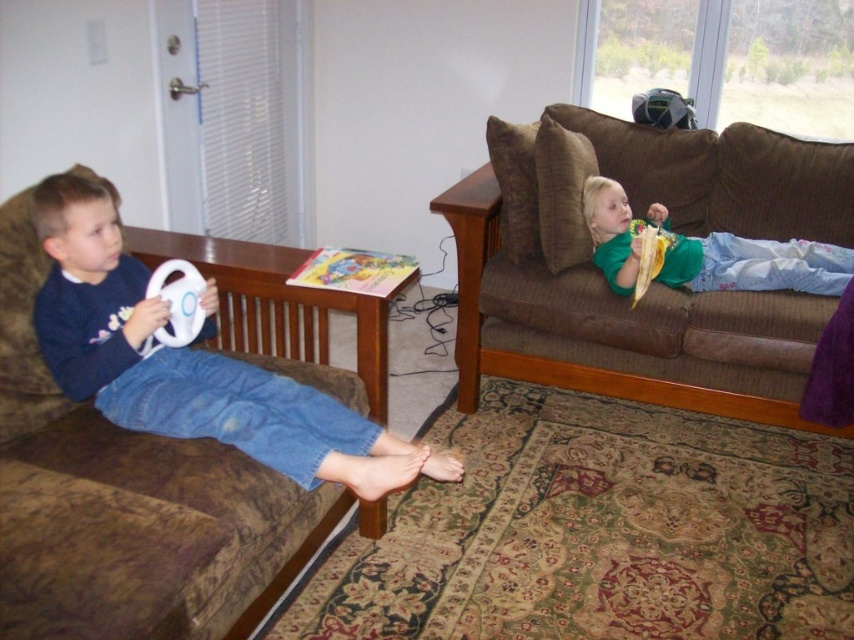
You are standing in the living room and see two points marked in the image. Which point, point (94, 442) or point (762, 262), is closer to you?

Point (94, 442) is closer to the viewer than point (762, 262).

You are a parent trying to decide where to place a new toy box in the living room. The toy box is the same size as the green cotton shirt at upper right. Based on the scene, can the toy box fit in the space where the brown fabric couch at left is currently located?

The brown fabric couch at left is larger in size than the green cotton shirt at upper right. Since the toy box is the same size as the green cotton shirt at upper right, it would fit in the space where the brown fabric couch at left is located because the couch is larger and the space can accommodate the smaller toy box.

You are a delivery person who needs to place a small package on the brown fabric couch at left without blocking the white matte steering wheel at left. Is there enough space on the couch for the package?

The brown fabric couch at left is larger in size than the white matte steering wheel at left, so there should be enough space on the couch to place the small package without blocking the steering wheel.